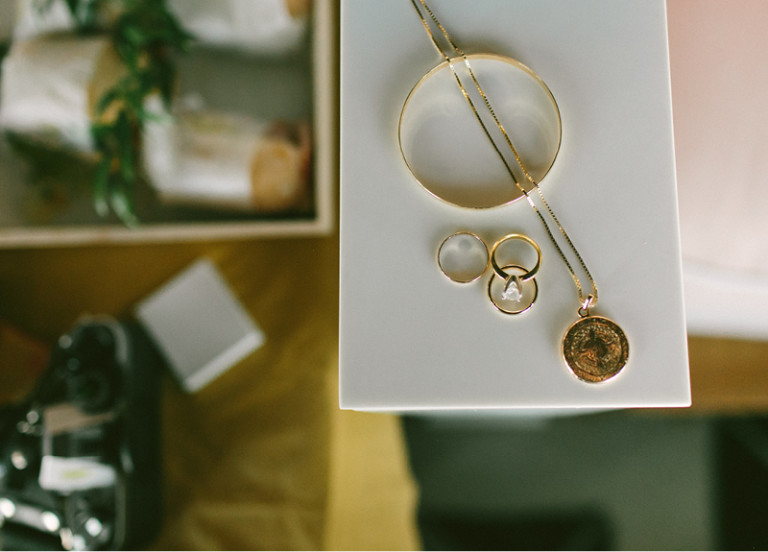
I want to click on brown table, so click(723, 383).